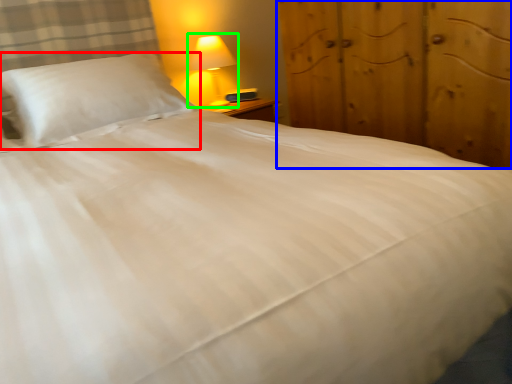
Question: Estimate the real-world distances between objects in this image. Which object is closer to pillow (highlighted by a red box), dresser (highlighted by a blue box) or lamp (highlighted by a green box)?

Choices:
 (A) dresser
 (B) lamp

Answer: (B)